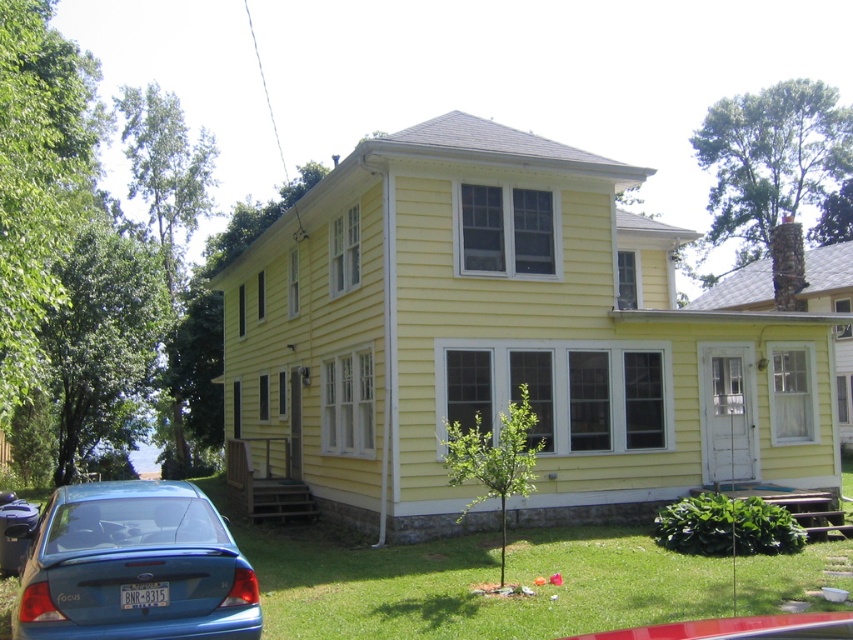
Question: Is yellow siding at center above blue matte sedan at lower left?

Choices:
 (A) no
 (B) yes

Answer: (B)

Question: Among these points, which one is nearest to the camera?

Choices:
 (A) (561, 173)
 (B) (119, 532)

Answer: (B)

Question: Is yellow siding at center positioned behind blue matte sedan at lower left?

Choices:
 (A) no
 (B) yes

Answer: (B)

Question: Which of the following is the closest to the observer?

Choices:
 (A) yellow siding at center
 (B) blue matte sedan at lower left

Answer: (B)

Question: Among these points, which one is nearest to the camera?

Choices:
 (A) (532, 518)
 (B) (236, 632)

Answer: (B)

Question: Is yellow siding at center to the right of blue matte sedan at lower left from the viewer's perspective?

Choices:
 (A) yes
 (B) no

Answer: (B)